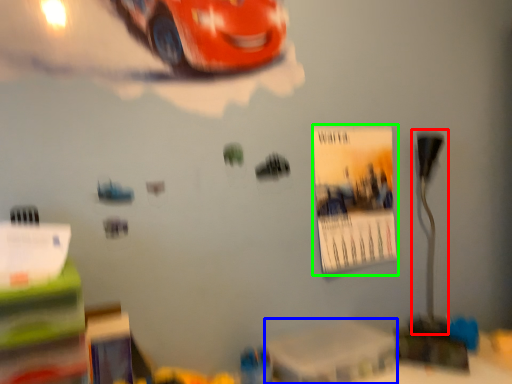
Question: Considering the real-world distances, which object is closest to table lamp (highlighted by a red box)? table (highlighted by a blue box) or poster page (highlighted by a green box).

Choices:
 (A) table
 (B) poster page

Answer: (B)